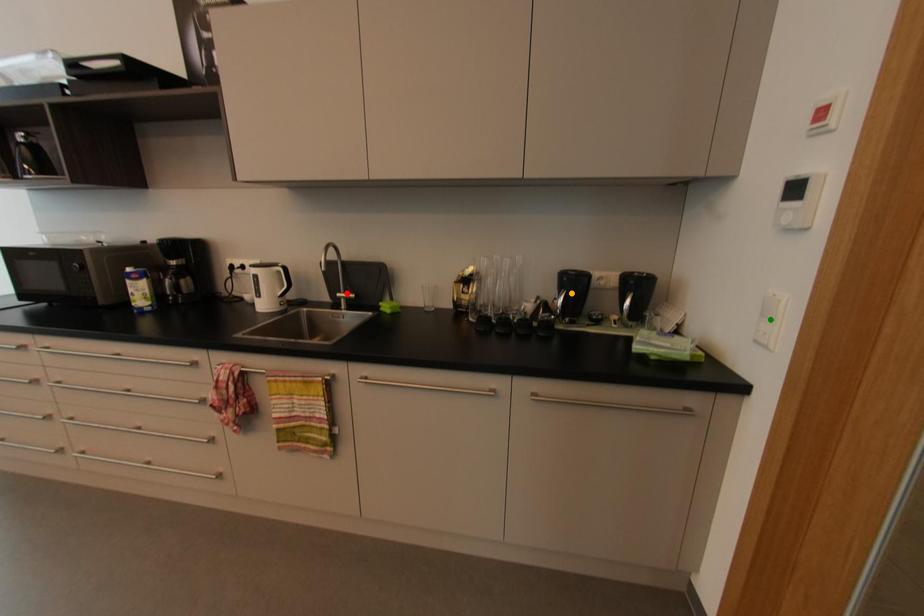
Order these from farthest to nearest:
red point
green point
orange point

red point
orange point
green point